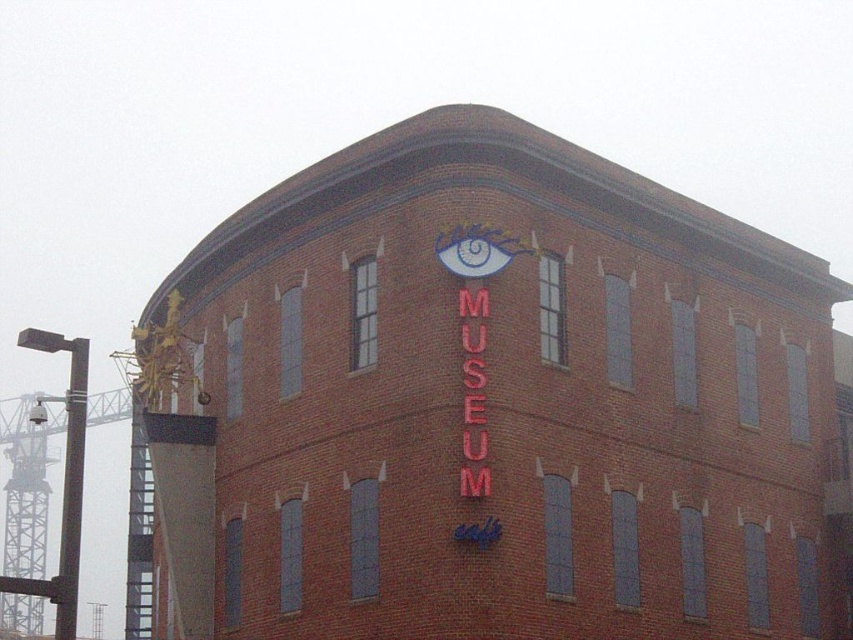
Question: Among these points, which one is nearest to the camera?

Choices:
 (A) coord(289,513)
 (B) coord(477,484)

Answer: (B)

Question: Can you confirm if red neon sign at upper center is positioned above red neon sign at center?

Choices:
 (A) yes
 (B) no

Answer: (B)

Question: Which object is farther from the camera taking this photo?

Choices:
 (A) red neon sign at upper center
 (B) red neon sign at center

Answer: (B)

Question: Is red neon sign at upper center to the left of red neon sign at center from the viewer's perspective?

Choices:
 (A) no
 (B) yes

Answer: (B)

Question: Observing the image, what is the correct spatial positioning of red neon sign at upper center in reference to red neon sign at center?

Choices:
 (A) above
 (B) below

Answer: (B)

Question: Among these objects, which one is nearest to the camera?

Choices:
 (A) red neon sign at upper center
 (B) red neon sign at center

Answer: (A)